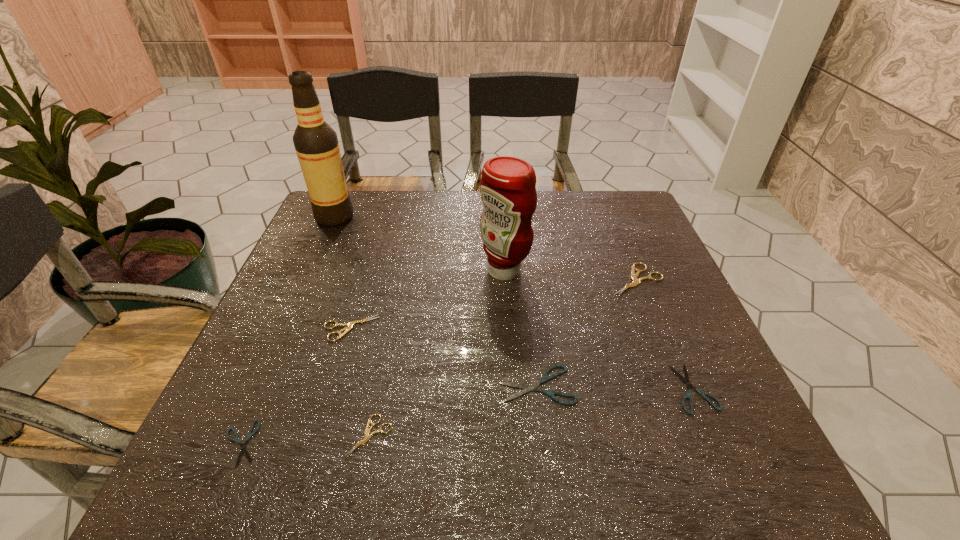
In order to click on free space at the far right corner of the desktop in this screenshot , I will do [629, 202].

The image size is (960, 540). Find the location of `unoccupied area between the third shears from right to left and the rightmost beige shears`. unoccupied area between the third shears from right to left and the rightmost beige shears is located at coordinates (587, 332).

The width and height of the screenshot is (960, 540). I want to click on free space that is in between the shortest object and the beige alcohol, so click(288, 330).

At what (x,y) coordinates should I click in order to perform the action: click on free space between the rightmost black shears and the fourth shears from left to right. Please return your answer as a coordinate pair (x, y). Looking at the image, I should click on (615, 386).

Find the location of a particular element. vacant space that is in between the farthest beige shears and the red condiment is located at coordinates (570, 275).

Identify the location of free space between the red condiment and the second smallest black shears. (599, 329).

What are the coordinates of `free space between the rightmost black shears and the smallest beige shears` in the screenshot? It's located at (532, 412).

You are a GUI agent. You are given a task and a screenshot of the screen. Output one action in this format:
    pyautogui.click(x=<x>, y=<y>)
    Task: Click on the vacant region between the third shears from right to left and the smallest beige shears
    The width and height of the screenshot is (960, 540).
    Given the screenshot: What is the action you would take?
    pyautogui.click(x=454, y=410)

This screenshot has height=540, width=960. I want to click on vacant region between the second biggest black shears and the nearest beige shears, so click(x=532, y=412).

This screenshot has width=960, height=540. Find the location of `vacant point located between the nearest beige shears and the smallest black shears`. vacant point located between the nearest beige shears and the smallest black shears is located at coordinates (305, 440).